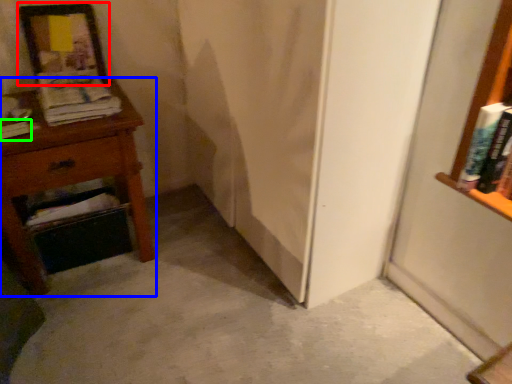
Question: Considering the real-world distances, which object is farthest from picture frame (highlighted by a red box)? nightstand (highlighted by a blue box) or book (highlighted by a green box)?

Choices:
 (A) nightstand
 (B) book

Answer: (B)